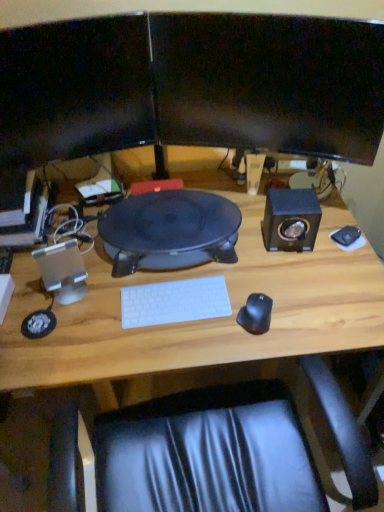
You are a GUI agent. You are given a task and a screenshot of the screen. Output one action in this format:
    pyautogui.click(x=<x>, y=<y>)
    Task: Click on the vacant point to the left of white plastic keyboard at center
    This screenshot has height=512, width=384.
    Given the screenshot: What is the action you would take?
    pyautogui.click(x=99, y=309)